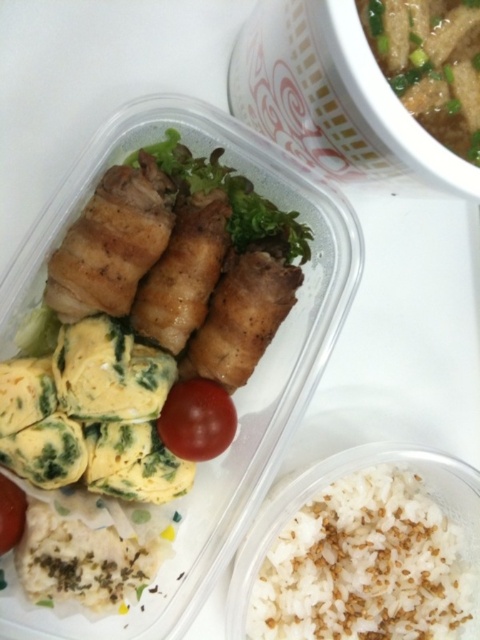
Does white rice at bottom right come behind green leafy vegetable at center?

Yes, it is behind green leafy vegetable at center.

From the picture: Can you confirm if white rice at bottom right is positioned above green leafy vegetable at center?

No.

At what (x,y) coordinates should I click in order to perform the action: click on white rice at bottom right. Please return your answer as a coordinate pair (x, y). Image resolution: width=480 pixels, height=640 pixels. Looking at the image, I should click on (363, 564).

What are the coordinates of `white rice at bottom right` in the screenshot? It's located at (363, 564).

Is point (409, 56) in front of point (9, 538)?

Yes, it is in front of point (9, 538).

Who is shorter, green leafy vegetable at upper right or red matte tomato at lower left?

red matte tomato at lower left is shorter.

Identify the location of green leafy vegetable at upper right. (431, 64).

This screenshot has height=640, width=480. What are the coordinates of `green leafy vegetable at upper right` in the screenshot? It's located at (431, 64).

Who is more forward, (358, 545) or (4, 488)?

Point (4, 488) is more forward.

Is point (338, 488) farther from camera compared to point (6, 538)?

That is True.

Find the location of a particular element. This screenshot has height=640, width=480. white rice at bottom right is located at coordinates (363, 564).